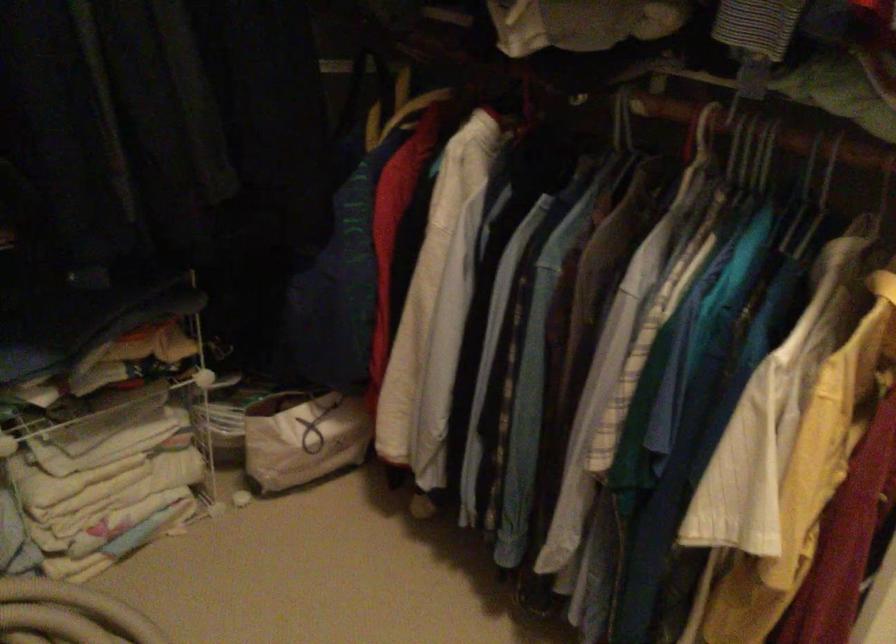
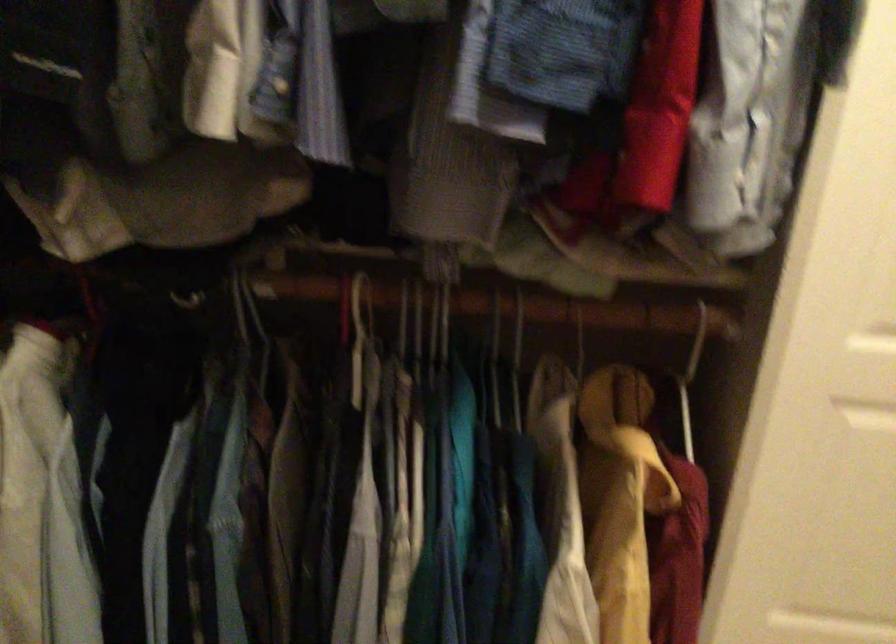
Locate, in the second image, the point that corresponds to (x=622, y=122) in the first image.

(247, 307)